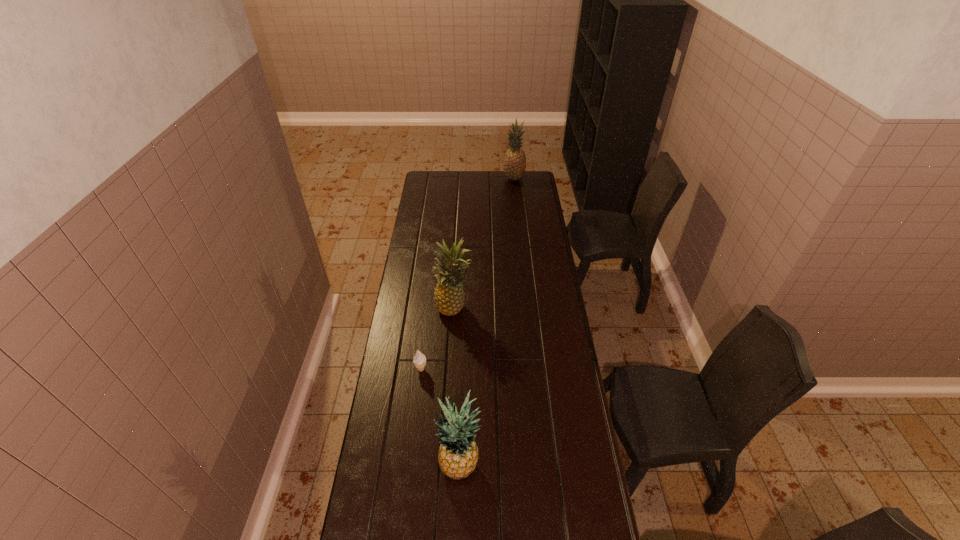
Locate an element on the screen. vacant space that is in between the farthest object and the nearest object is located at coordinates (487, 323).

Locate an element on the screen. This screenshot has height=540, width=960. free spot between the nearest object and the second nearest pineapple is located at coordinates (457, 388).

You are a GUI agent. You are given a task and a screenshot of the screen. Output one action in this format:
    pyautogui.click(x=<x>, y=<y>)
    Task: Click on the vacant space in between the farthest object and the second farthest pineapple
    
    Given the screenshot: What is the action you would take?
    coord(484,244)

The image size is (960, 540). I want to click on empty space between the farthest object and the third farthest object, so click(x=468, y=274).

You are a GUI agent. You are given a task and a screenshot of the screen. Output one action in this format:
    pyautogui.click(x=<x>, y=<y>)
    Task: Click on the free point between the nearest object and the second nearest pineapple
    This screenshot has width=960, height=540.
    Given the screenshot: What is the action you would take?
    click(x=457, y=388)

Identify the location of free spot between the second farthest pineapple and the farthest object. The image size is (960, 540). (484, 244).

Locate an element on the screen. free space between the nearest object and the second farthest object is located at coordinates pos(457,388).

At what (x,y) coordinates should I click in order to perform the action: click on blank region between the farthest object and the nearest object. Please return your answer as a coordinate pair (x, y). The image size is (960, 540). Looking at the image, I should click on (487, 323).

Choose which object is the nearest neighbor to the leftmost object. Please provide its 2D coordinates. Your answer should be formatted as a tuple, i.e. [(x, y)], where the tuple contains the x and y coordinates of a point satisfying the conditions above.

[(449, 297)]

You are a GUI agent. You are given a task and a screenshot of the screen. Output one action in this format:
    pyautogui.click(x=<x>, y=<y>)
    Task: Click on the third closest object to the rightmost pineapple
    
    Given the screenshot: What is the action you would take?
    pyautogui.click(x=458, y=453)